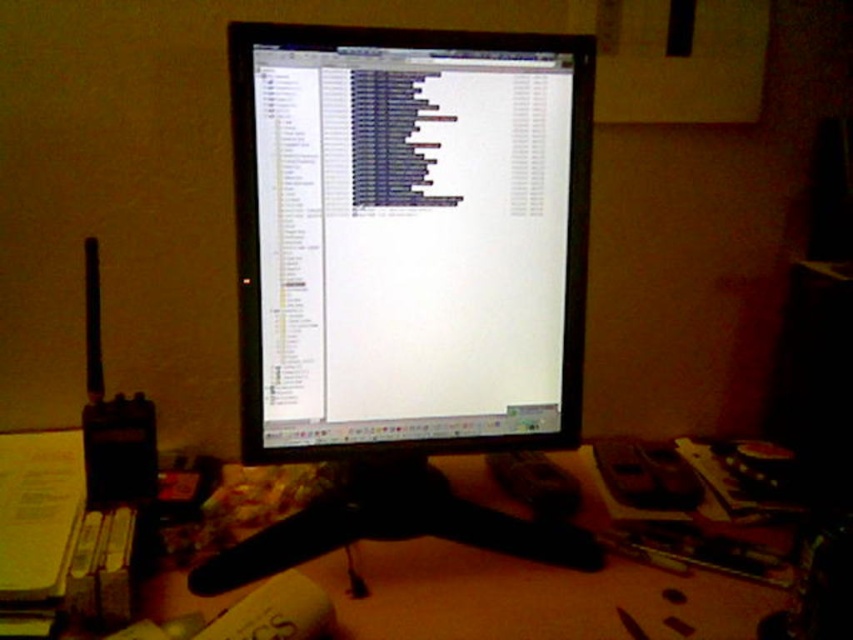
You are an office worker who needs to place a 10 inch wide document on the desk between the matte black monitor at center and the wooden at center. Can the document fit in that space?

The distance between the matte black monitor at center and the wooden at center is 11.66 inches, so the 10 inch wide document can fit in the space between them.

You are setting up a new monitor in the workspace. The existing setup has the matte black monitor at center. Where should you place the new monitor to avoid overlapping with the existing one?

The matte black monitor at center is located at point (409,237), so you should place the new monitor in a different position to avoid overlapping.

You are navigating a robotic arm in this workspace. The robotic arm needs to pick up an object from point A and place it at point B. If point A is point (352, 164) and point B is point (479, 605), will the robotic arm be able to move the object directly from A to B without any obstruction?

Point (352, 164) is behind point (479, 605), so the robotic arm will have an obstruction between them, making it unable to move the object directly from A to B.